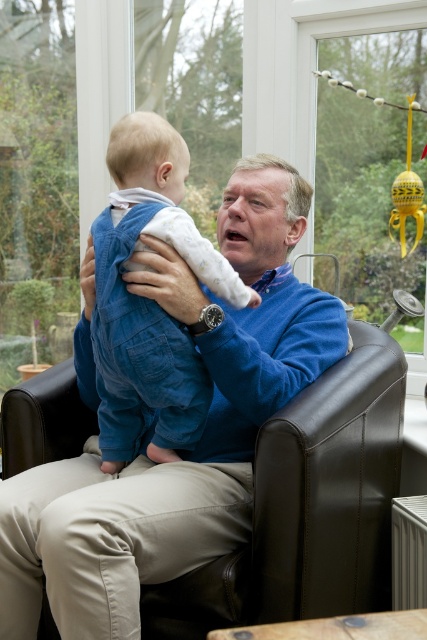
Where is the blue sweater at center located in the image?

The blue sweater at center is located at point (198, 442) in the image.

You are a photographer setting up a shoot in this scene. You need to ensure that the blue sweater at center and the denim overalls at center are both visible in the photo. Based on their positions, which one should you focus on first to make sure both are in frame?

The blue sweater at center is in front of the denim overalls at center, so you should focus on the denim overalls at center first to ensure both are visible in the frame.